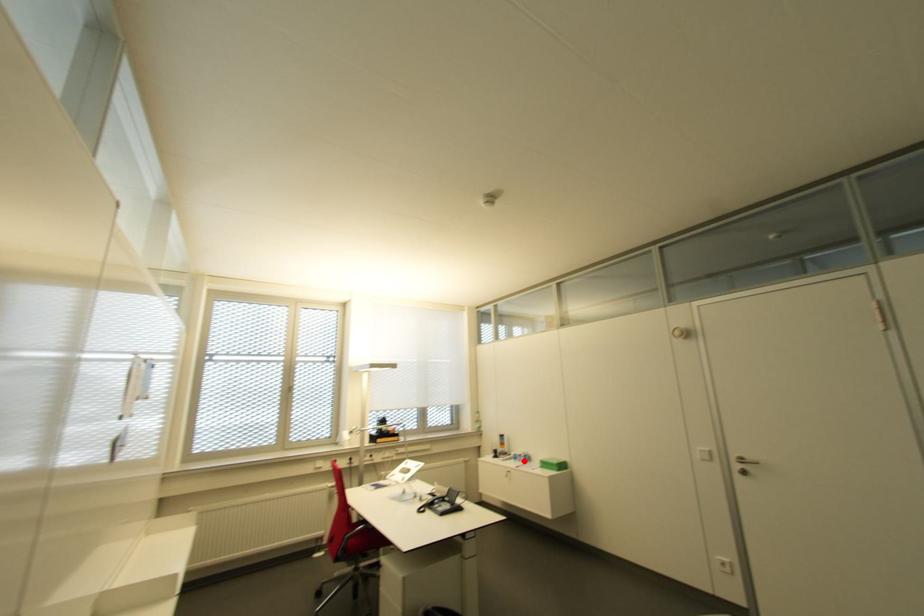
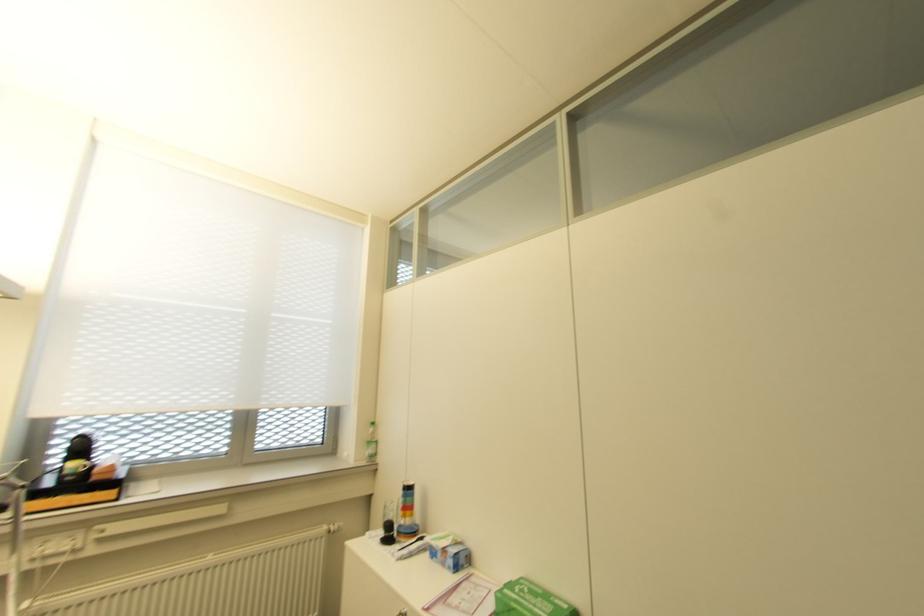
Find the pixel in the second image that matches the highlighted location in the first image.

(454, 568)